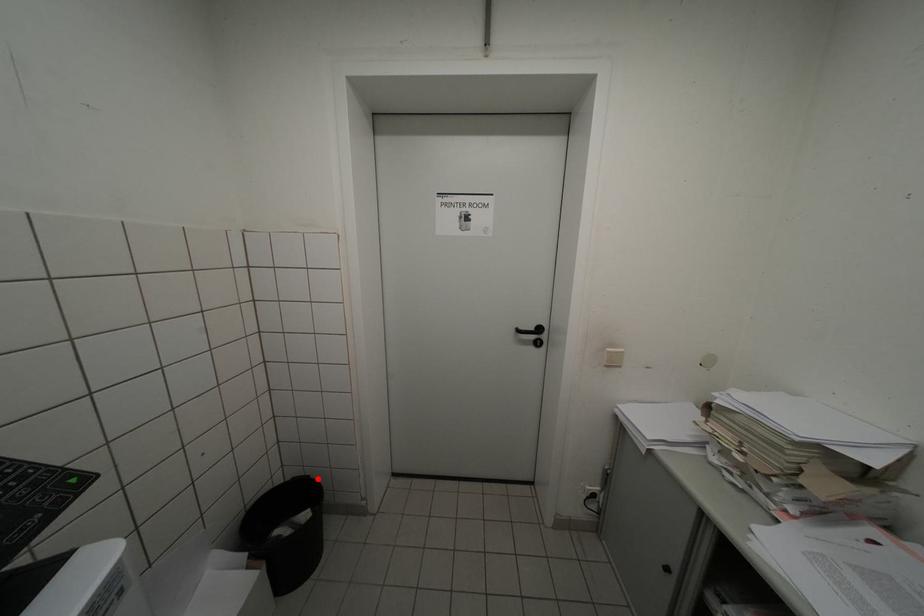
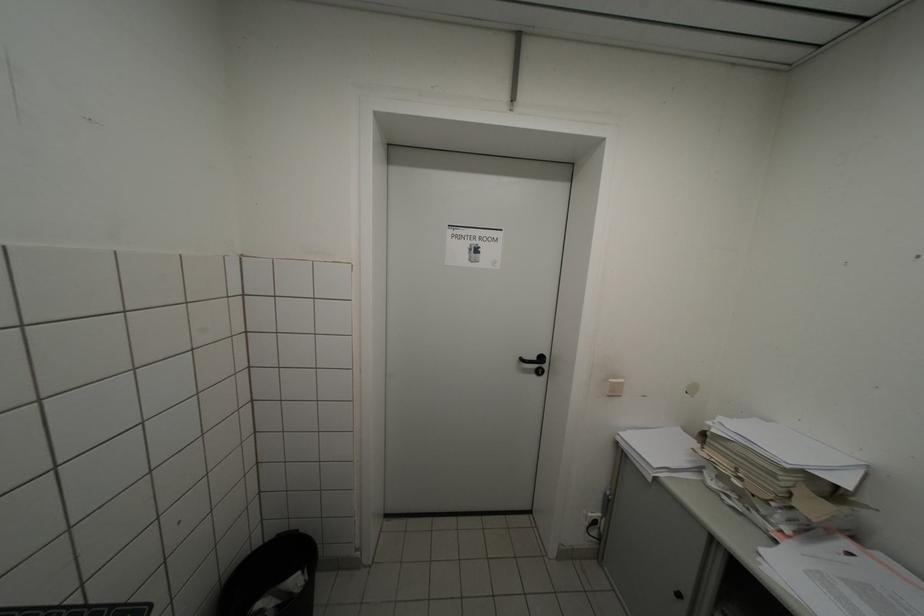
Locate, in the second image, the point that corresponds to the highlighted location in the first image.

(306, 533)